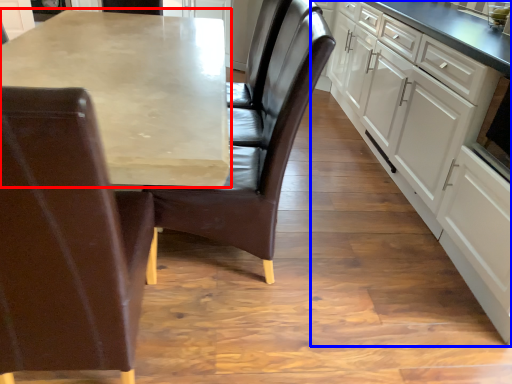
Question: Among these objects, which one is nearest to the camera, countertop (highlighted by a red box) or cabinetry (highlighted by a blue box)?

Choices:
 (A) countertop
 (B) cabinetry

Answer: (A)